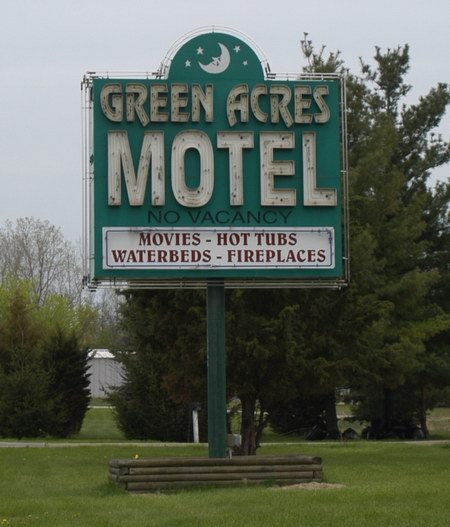
Locate an element on the screen. This screenshot has height=527, width=450. waterbeds is located at coordinates (x=174, y=259).